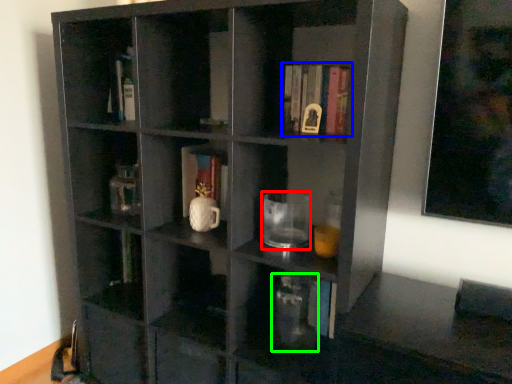
Question: Considering the real-world distances, which object is closest to mug (highlighted by a red box)? book (highlighted by a blue box) or glass vase (highlighted by a green box).

Choices:
 (A) book
 (B) glass vase

Answer: (B)